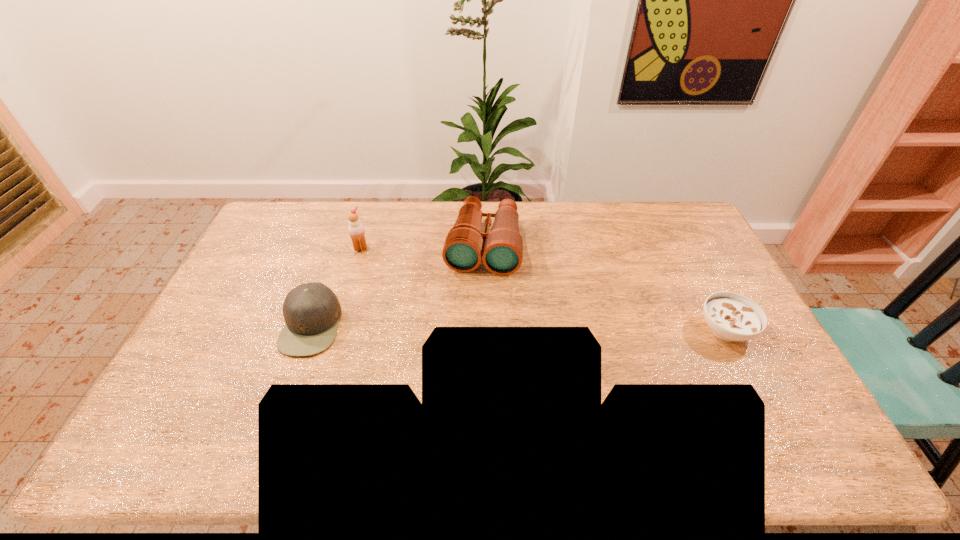
This screenshot has width=960, height=540. In the image, there is a desktop. Identify the location of vacant space at the left edge. (265, 279).

In order to click on blank area at the right edge in this screenshot , I will do `click(711, 262)`.

Find the location of a particular element. The height and width of the screenshot is (540, 960). vacant space at the far left corner of the desktop is located at coordinates (300, 201).

Where is `vacant space at the far right corner`? The width and height of the screenshot is (960, 540). vacant space at the far right corner is located at coordinates (678, 237).

Identify the location of free space between the third object from left to right and the cap. Image resolution: width=960 pixels, height=540 pixels. (397, 286).

You are a GUI agent. You are given a task and a screenshot of the screen. Output one action in this format:
    pyautogui.click(x=<x>, y=<y>)
    Task: Click on the free space between the soup bowl and the icecream
    
    Given the screenshot: What is the action you would take?
    tap(543, 289)

Find the location of a particular element. free space between the soup bowl and the third object from left to right is located at coordinates (604, 288).

This screenshot has width=960, height=540. Identify the location of vacant area between the second shortest object and the shortest object. (518, 327).

What are the coordinates of `empty space that is in between the binoculars and the icecream` in the screenshot? It's located at (421, 247).

The width and height of the screenshot is (960, 540). What are the coordinates of `vacant area that lies between the icecream and the third tallest object` in the screenshot? It's located at (336, 287).